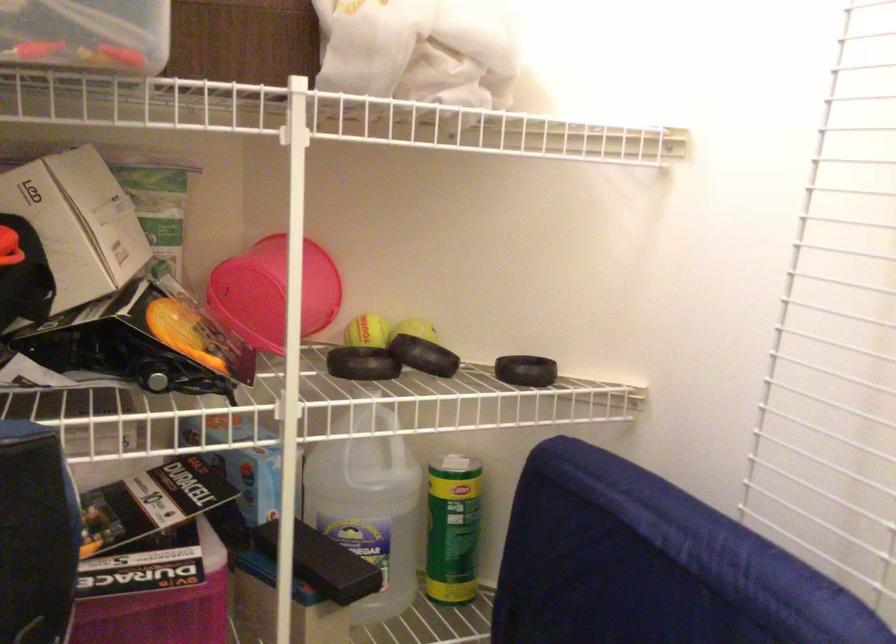
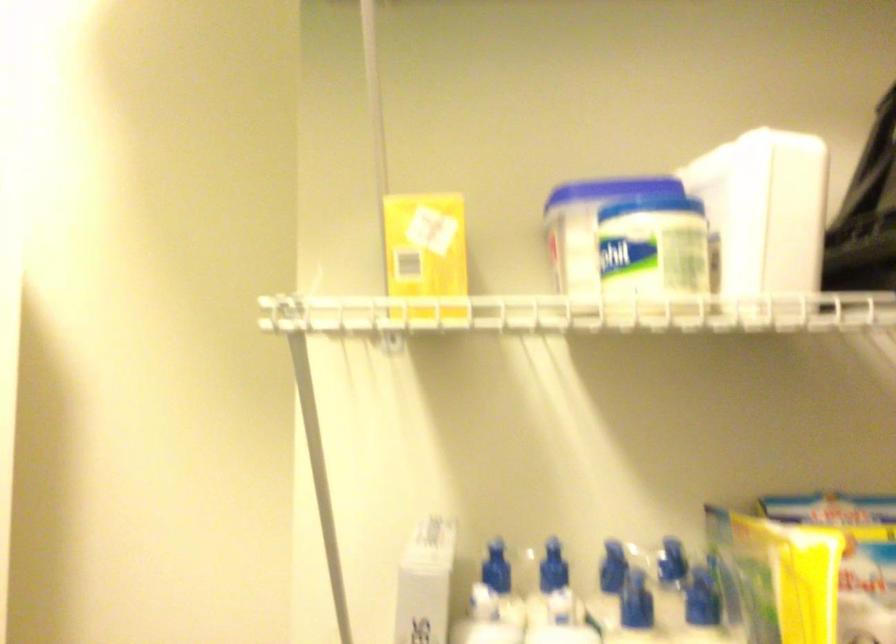
In a continuous first-person perspective shot, in which direction is the camera moving?

The movement direction of the cameraman is right, backward.